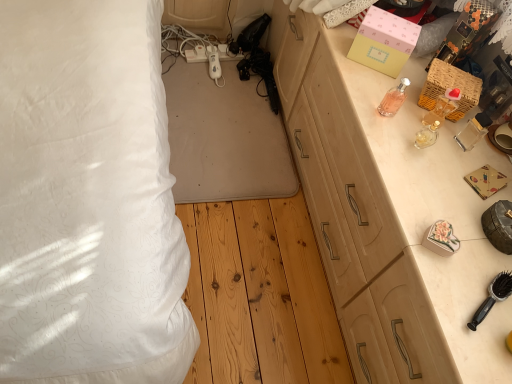
Where is `free space between black plastic brush at lower right and pink glass bottle at upper right, the first perfume in the left-to-right sequence`? This screenshot has width=512, height=384. free space between black plastic brush at lower right and pink glass bottle at upper right, the first perfume in the left-to-right sequence is located at coordinates (430, 201).